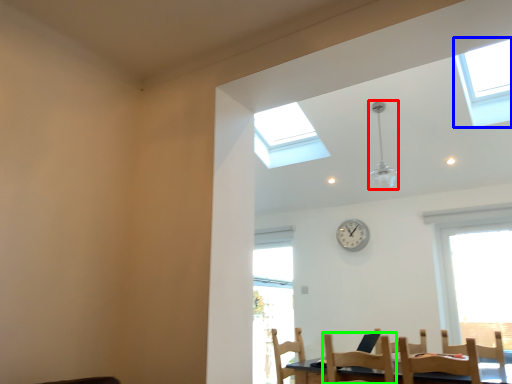
Question: Based on their relative distances, which object is farther from light fixture (highlighted by a red box)? Choose from window (highlighted by a blue box) and chair (highlighted by a green box).

Choices:
 (A) window
 (B) chair

Answer: (B)